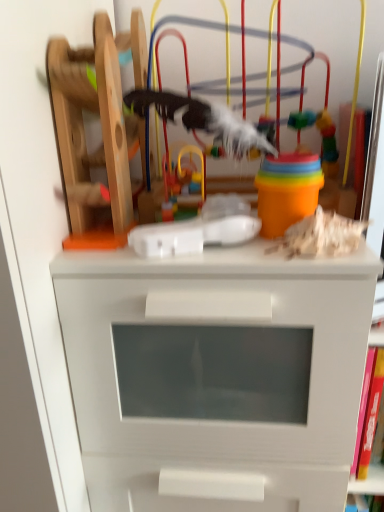
Question: Looking at their shapes, would you say wooden toy at upper center, which appears as the 3th toy when viewed from the left, is wider or thinner than multicolored plastic toy at center, which appears as the 3th toy when viewed from the right?

Choices:
 (A) thin
 (B) wide

Answer: (B)

Question: Considering the positions of wooden toy at upper center, the second toy positioned from the right, and multicolored plastic toy at center, which appears as the 3th toy when viewed from the right, in the image, is wooden toy at upper center, the second toy positioned from the right, taller or shorter than multicolored plastic toy at center, which appears as the 3th toy when viewed from the right,?

Choices:
 (A) short
 (B) tall

Answer: (B)

Question: Considering the real-world distances, which object is farthest from the wooden toy at upper right, which appears as the first toy when viewed from the right?

Choices:
 (A) white matte chest of drawers at center
 (B) multicolored plastic toy at center, which appears as the 3th toy when viewed from the right
 (C) wooden toy at upper center, the second toy positioned from the right
 (D) wooden roller coaster at left, which appears as the 4th toy when viewed from the right

Answer: (C)

Question: Which of these objects is positioned closest to the wooden roller coaster at left, the 1th toy from the left?

Choices:
 (A) multicolored plastic toy at center, which is the 2th toy in left-to-right order
 (B) white matte chest of drawers at center
 (C) wooden toy at upper center, which appears as the 3th toy when viewed from the left
 (D) wooden toy at upper right, positioned as the 4th toy in left-to-right order

Answer: (C)